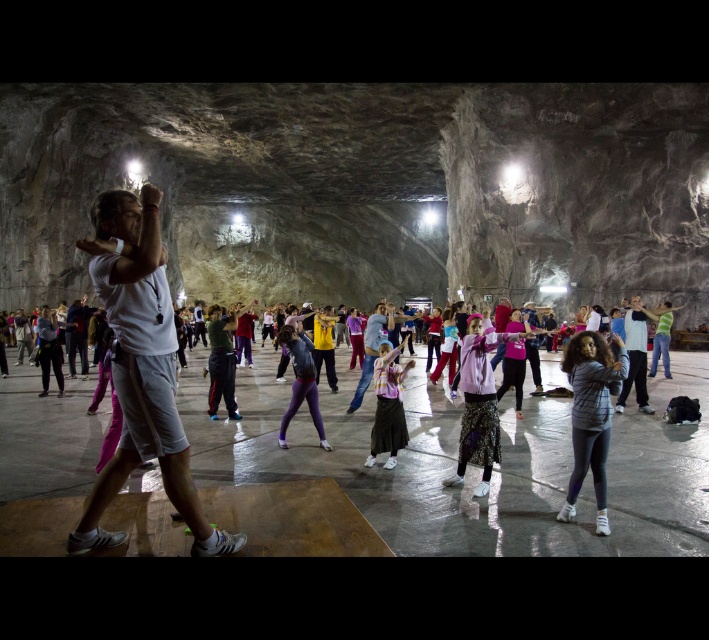
Question: Does striped fabric shirt at center come in front of white matte shirt at center?

Choices:
 (A) yes
 (B) no

Answer: (A)

Question: Can you confirm if pink fabric at center is bigger than green fabric shirt at center?

Choices:
 (A) yes
 (B) no

Answer: (A)

Question: Based on their relative distances, which object is nearer to the green fabric shirt at center?

Choices:
 (A) white matte shirt at center
 (B) striped fabric skirt at center

Answer: (B)

Question: Is striped fabric shirt at center positioned before white matte shirt at center?

Choices:
 (A) yes
 (B) no

Answer: (A)

Question: Estimate the real-world distances between objects in this image. Which object is closer to the matte black jacket at center?

Choices:
 (A) green fabric shirt at center
 (B) striped fabric skirt at center
 (C) pink fabric at center

Answer: (B)

Question: Which is nearer to the matte black jacket at center?

Choices:
 (A) striped fabric shirt at center
 (B) pink fabric at center
 (C) white cotton shirt at center
 (D) white matte shirt at center

Answer: (B)